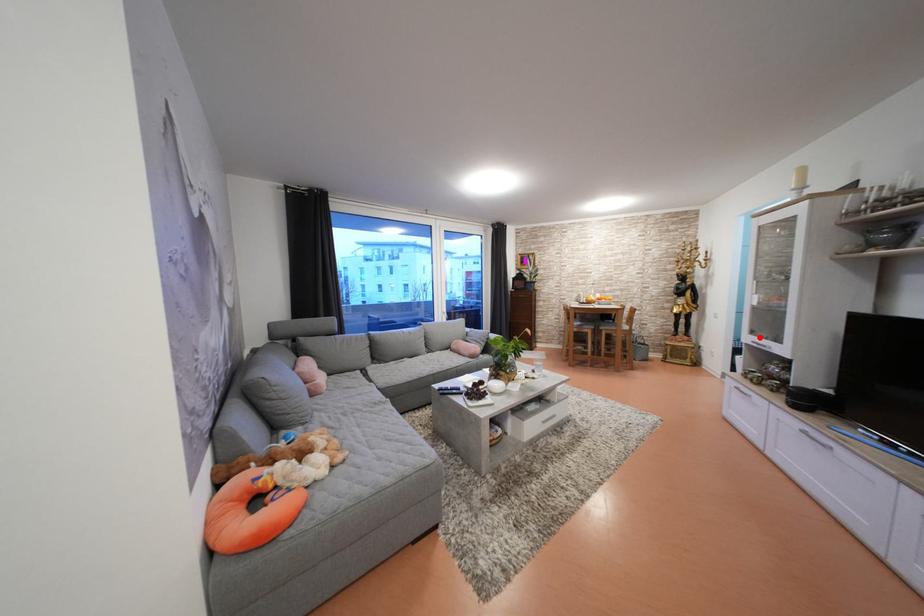
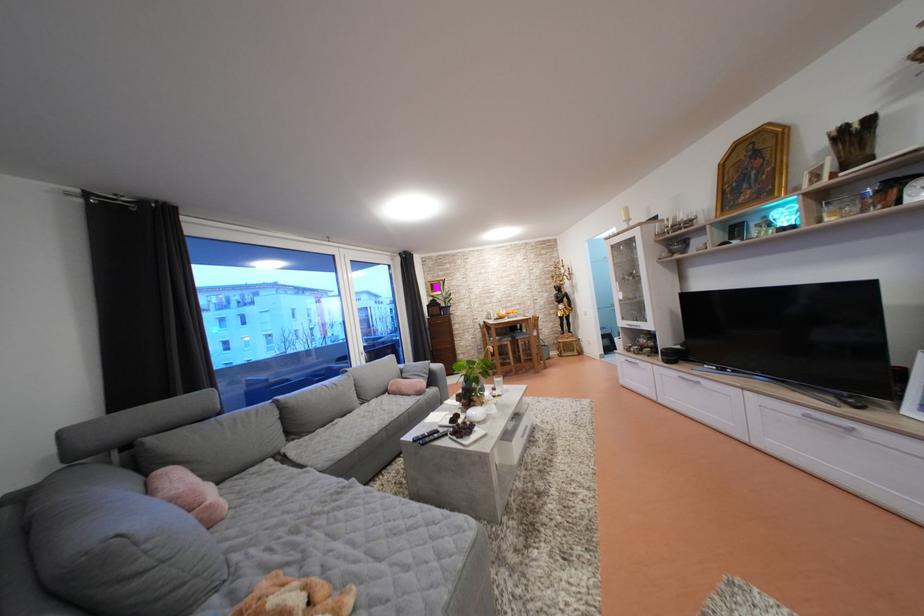
Where in the second image is the point corresponding to the highlighted location from the first image?

(629, 323)